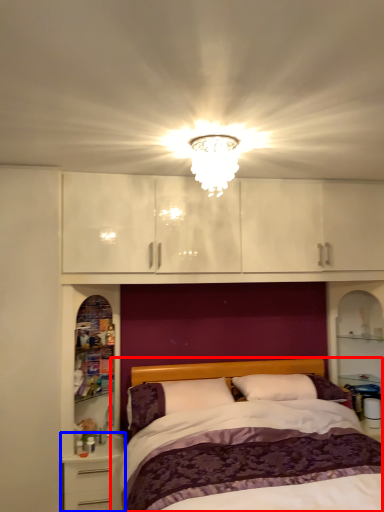
Question: Which object appears farthest to the camera in this image, bed (highlighted by a red box) or nightstand (highlighted by a blue box)?

Choices:
 (A) bed
 (B) nightstand

Answer: (B)